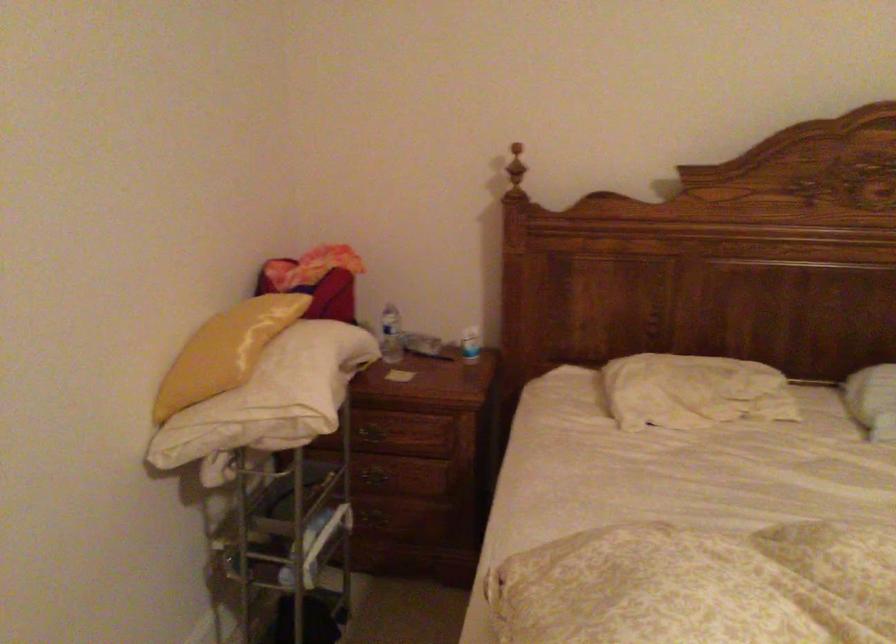
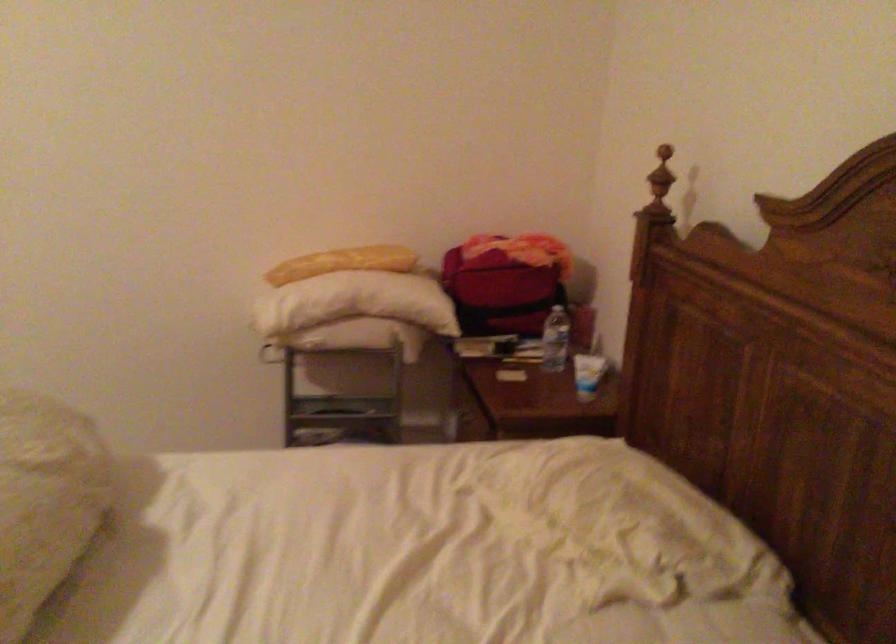
Locate, in the second image, the point that corresponds to (409,330) in the first image.

(556, 339)